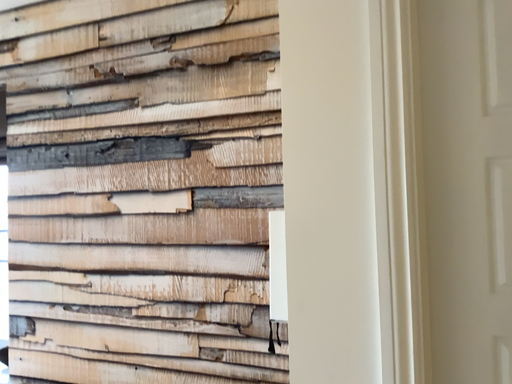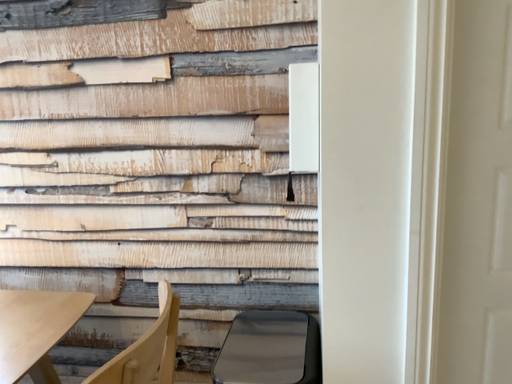
Question: Which way did the camera rotate in the video?

Choices:
 (A) rotated left
 (B) rotated right

Answer: (B)